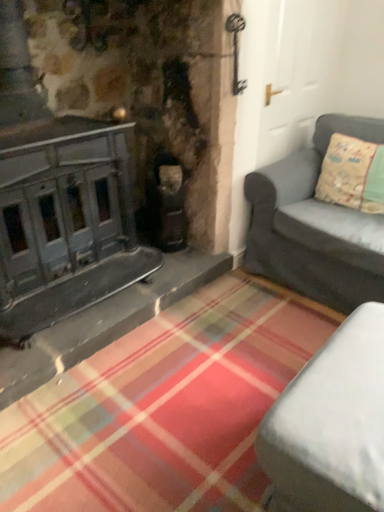
Question: Can you confirm if matte gray couch at right, which is counted as the second studio couch, starting from the bottom, is wider than white fabric studio couch at lower right, marked as the 1th studio couch in a bottom-to-top arrangement?

Choices:
 (A) no
 (B) yes

Answer: (B)

Question: From a real-world perspective, is matte gray couch at right, which is counted as the second studio couch, starting from the bottom, on top of white fabric studio couch at lower right, positioned as the first studio couch in front-to-back order?

Choices:
 (A) no
 (B) yes

Answer: (B)

Question: Is matte gray couch at right, which is counted as the second studio couch, starting from the bottom, bigger than white fabric studio couch at lower right, positioned as the first studio couch in front-to-back order?

Choices:
 (A) yes
 (B) no

Answer: (A)

Question: Is matte gray couch at right, the 1th studio couch when ordered from back to front, outside white fabric studio couch at lower right, which appears as the second studio couch when viewed from the back?

Choices:
 (A) no
 (B) yes

Answer: (B)

Question: Is matte gray couch at right, placed as the first studio couch when sorted from top to bottom, shorter than white fabric studio couch at lower right, positioned as the first studio couch in front-to-back order?

Choices:
 (A) no
 (B) yes

Answer: (A)

Question: Relative to light green fabric pillow at right, is white fabric studio couch at lower right, positioned as the first studio couch in front-to-back order, in front or behind?

Choices:
 (A) behind
 (B) front

Answer: (B)

Question: Would you say white fabric studio couch at lower right, positioned as the first studio couch in front-to-back order, is inside or outside light green fabric pillow at right?

Choices:
 (A) inside
 (B) outside

Answer: (B)

Question: From a real-world perspective, is white fabric studio couch at lower right, marked as the 1th studio couch in a bottom-to-top arrangement, positioned above or below light green fabric pillow at right?

Choices:
 (A) below
 (B) above

Answer: (A)

Question: From the image's perspective, is white fabric studio couch at lower right, which is counted as the second studio couch, starting from the top, located above or below light green fabric pillow at right?

Choices:
 (A) above
 (B) below

Answer: (B)

Question: Looking at the image, does matte gray couch at right, which is counted as the second studio couch, starting from the bottom, seem bigger or smaller compared to light green fabric pillow at right?

Choices:
 (A) small
 (B) big

Answer: (B)

Question: Considering the positions of matte gray couch at right, placed as the first studio couch when sorted from top to bottom, and light green fabric pillow at right in the image, is matte gray couch at right, placed as the first studio couch when sorted from top to bottom, wider or thinner than light green fabric pillow at right?

Choices:
 (A) wide
 (B) thin

Answer: (A)

Question: From the image's perspective, is matte gray couch at right, placed as the first studio couch when sorted from top to bottom, positioned above or below light green fabric pillow at right?

Choices:
 (A) below
 (B) above

Answer: (A)

Question: Would you say matte gray couch at right, which is counted as the second studio couch, starting from the bottom, is to the left or to the right of light green fabric pillow at right in the picture?

Choices:
 (A) left
 (B) right

Answer: (A)

Question: Is white fabric studio couch at lower right, positioned as the first studio couch in front-to-back order, wider or thinner than matte gray couch at right, placed as the first studio couch when sorted from top to bottom?

Choices:
 (A) thin
 (B) wide

Answer: (A)

Question: Looking at the image, does white fabric studio couch at lower right, marked as the 1th studio couch in a bottom-to-top arrangement, seem bigger or smaller compared to matte gray couch at right, the 1th studio couch when ordered from back to front?

Choices:
 (A) small
 (B) big

Answer: (A)